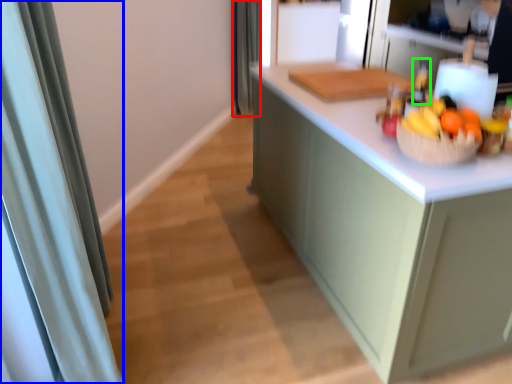
Question: Considering the real-world distances, which object is farthest from shower curtain (highlighted by a red box)? shower curtain (highlighted by a blue box) or bottle (highlighted by a green box)?

Choices:
 (A) shower curtain
 (B) bottle

Answer: (A)